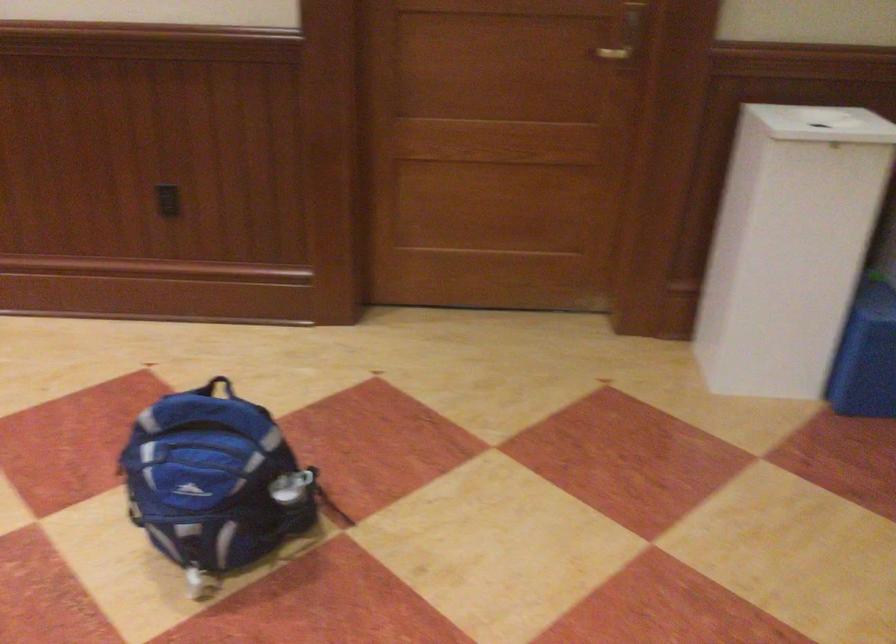
Describe the element at coordinates (625, 40) in the screenshot. I see `the gold door handle` at that location.